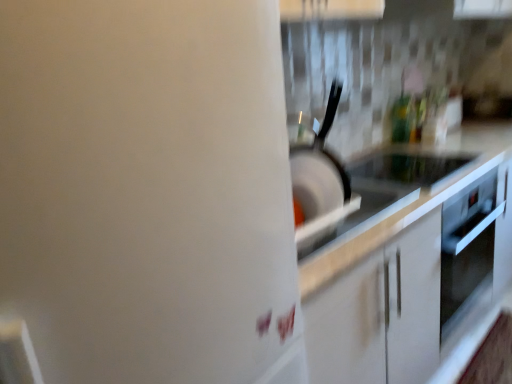
Identify the location of white glossy countertop at center. (412, 259).

Between black matte frying pan at center and white glossy water heater at upper right, which one appears on the right side from the viewer's perspective?

Positioned to the right is black matte frying pan at center.

Does black matte frying pan at center lie behind white glossy water heater at upper right?

Yes, black matte frying pan at center is further from the viewer.

Which object is wider, black matte frying pan at center or white glossy water heater at upper right?

With larger width is white glossy water heater at upper right.

Does black matte frying pan at center have a greater height compared to white glossy water heater at upper right?

No.

From a real-world perspective, which is physically below, black matte frying pan at center or black glass cooktop at center?

From a 3D spatial view, black glass cooktop at center is below.

Between point (317, 142) and point (410, 184), which one is positioned in front?

Positioned in front is point (317, 142).

Can you confirm if black glass cooktop at center is positioned to the right of white glossy countertop at center?

In fact, black glass cooktop at center is to the left of white glossy countertop at center.

Does black glass cooktop at center turn towards white glossy countertop at center?

No.

Is black glass cooktop at center far from white glossy countertop at center?

No, black glass cooktop at center is not far away from white glossy countertop at center.

Is white glossy water heater at upper right far from black glass cooktop at center?

Yes, white glossy water heater at upper right is far from black glass cooktop at center.

Does white glossy water heater at upper right have a smaller size compared to black glass cooktop at center?

No, white glossy water heater at upper right is not smaller than black glass cooktop at center.

Identify the location of countertop that appears below the white glossy water heater at upper right (from a real-world perspective). The width and height of the screenshot is (512, 384). (412, 259).

From a real-world perspective, between white glossy water heater at upper right and white glossy countertop at center, who is vertically lower?

white glossy countertop at center, from a real-world perspective.

Considering the sizes of white glossy water heater at upper right and white glossy countertop at center in the image, is white glossy water heater at upper right taller or shorter than white glossy countertop at center?

Clearly, white glossy water heater at upper right is taller compared to white glossy countertop at center.

From the image's perspective, would you say white glossy water heater at upper right is shown under white glossy countertop at center?

No, from the image's perspective, white glossy water heater at upper right is not beneath white glossy countertop at center.

From a real-world perspective, between black matte frying pan at center and white glossy countertop at center, who is vertically lower?

white glossy countertop at center is physically lower.

Considering the relative sizes of black matte frying pan at center and white glossy countertop at center in the image provided, is black matte frying pan at center taller than white glossy countertop at center?

In fact, black matte frying pan at center may be shorter than white glossy countertop at center.

From the image's perspective, would you say black matte frying pan at center is shown under white glossy countertop at center?

Incorrect, from the image's perspective, black matte frying pan at center is higher than white glossy countertop at center.

How many degrees apart are the facing directions of black matte frying pan at center and white glossy countertop at center?

The facing directions of black matte frying pan at center and white glossy countertop at center are 94.2 degrees apart.

Is black glass cooktop at center wider or thinner than white glossy water heater at upper right?

In the image, black glass cooktop at center appears to be more narrow than white glossy water heater at upper right.

Would you say black glass cooktop at center is to the left or to the right of white glossy water heater at upper right in the picture?

In the image, black glass cooktop at center appears on the right side of white glossy water heater at upper right.

Looking at this image, is black glass cooktop at center turned away from white glossy water heater at upper right?

No, black glass cooktop at center is not facing the opposite direction of white glossy water heater at upper right.

You are a GUI agent. You are given a task and a screenshot of the screen. Output one action in this format:
    pyautogui.click(x=<x>, y=<y>)
    Task: Click on the appliance below the white glossy water heater at upper right (from a real-world perspective)
    
    Given the screenshot: What is the action you would take?
    pyautogui.click(x=404, y=170)

Locate an element on the screen. Image resolution: width=512 pixels, height=384 pixels. home appliance in front of the black matte frying pan at center is located at coordinates (148, 191).

Where is `appliance on the right of the black matte frying pan at center`? This screenshot has width=512, height=384. appliance on the right of the black matte frying pan at center is located at coordinates (404, 170).

Which object lies nearer to the anchor point white glossy water heater at upper right, black glass cooktop at center or white glossy countertop at center?

Based on the image, white glossy countertop at center appears to be nearer to white glossy water heater at upper right.

Which object lies nearer to the anchor point white glossy countertop at center, black matte frying pan at center or white glossy water heater at upper right?

black matte frying pan at center.

Which object lies nearer to the anchor point white glossy countertop at center, black glass cooktop at center or white glossy water heater at upper right?

The object closer to white glossy countertop at center is black glass cooktop at center.

Consider the image. Based on their spatial positions, is white glossy countertop at center or black matte frying pan at center further from black glass cooktop at center?

black matte frying pan at center is positioned further to the anchor black glass cooktop at center.

Based on their spatial positions, is black matte frying pan at center or black glass cooktop at center closer to white glossy countertop at center?

Based on the image, black glass cooktop at center appears to be nearer to white glossy countertop at center.

Considering their positions, is white glossy water heater at upper right positioned further to black glass cooktop at center than black matte frying pan at center?

white glossy water heater at upper right.

Considering their positions, is white glossy water heater at upper right positioned further to white glossy countertop at center than black matte frying pan at center?

white glossy water heater at upper right is positioned further to the anchor white glossy countertop at center.

Based on their spatial positions, is black matte frying pan at center or white glossy water heater at upper right further from black glass cooktop at center?

white glossy water heater at upper right.

Locate an element on the screen. This screenshot has width=512, height=384. appliance situated between black matte frying pan at center and white glossy countertop at center from left to right is located at coordinates [404, 170].

You are a GUI agent. You are given a task and a screenshot of the screen. Output one action in this format:
    pyautogui.click(x=<x>, y=<y>)
    Task: Click on the kitchen appliance between white glossy water heater at upper right and white glossy countertop at center from front to back
    The height and width of the screenshot is (384, 512).
    Given the screenshot: What is the action you would take?
    pyautogui.click(x=319, y=169)

Locate an element on the screen. countertop between white glossy water heater at upper right and black glass cooktop at center from front to back is located at coordinates (412, 259).

The width and height of the screenshot is (512, 384). What are the coordinates of `kitchen appliance between white glossy water heater at upper right and black glass cooktop at center from front to back` in the screenshot? It's located at (319, 169).